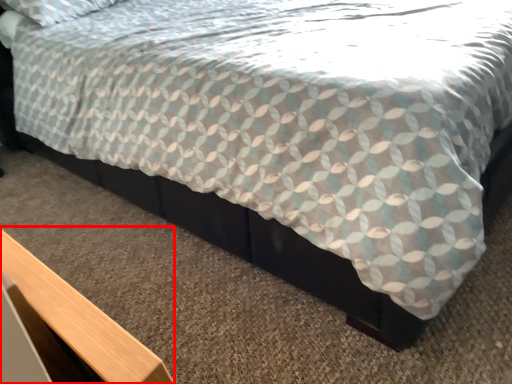
Question: In this image, where is table (annotated by the red box) located relative to bed frame?

Choices:
 (A) left
 (B) right

Answer: (A)